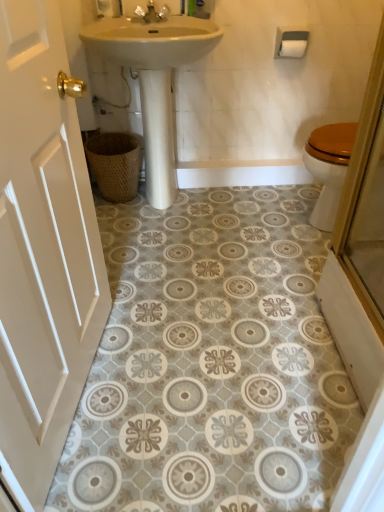
You are a GUI agent. You are given a task and a screenshot of the screen. Output one action in this format:
    pyautogui.click(x=<x>, y=<y>)
    Task: Click on the vacant space to the left of matte gold faucet at upper center
    The width and height of the screenshot is (384, 512).
    Given the screenshot: What is the action you would take?
    pyautogui.click(x=113, y=24)